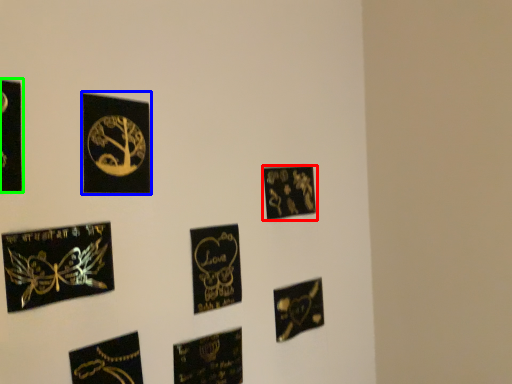
Question: Which is nearer to the picture frame (highlighted by a red box)? picture frame (highlighted by a blue box) or picture frame (highlighted by a green box).

Choices:
 (A) picture frame
 (B) picture frame

Answer: (A)